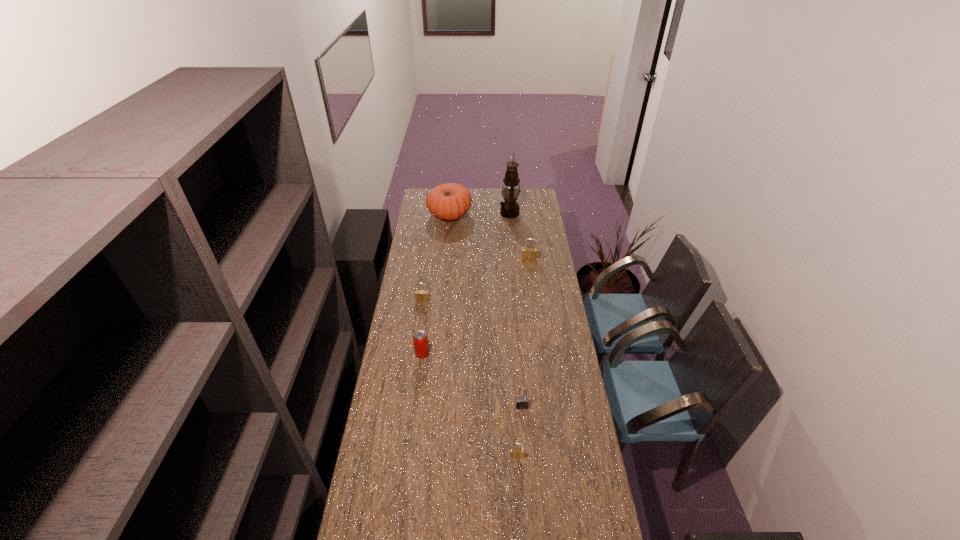
Locate an element on the screen. Image resolution: width=960 pixels, height=540 pixels. oil lamp is located at coordinates (509, 208).

At what (x,y) coordinates should I click in order to perform the action: click on brown oil lamp. Please return your answer as a coordinate pair (x, y). Looking at the image, I should click on (509, 208).

Image resolution: width=960 pixels, height=540 pixels. I want to click on pumpkin, so click(450, 201).

Locate an element on the screen. orange pumpkin is located at coordinates (450, 201).

Image resolution: width=960 pixels, height=540 pixels. Find the location of `the tallest padlock`. the tallest padlock is located at coordinates (528, 254).

Locate an element on the screen. The height and width of the screenshot is (540, 960). the sixth nearest object is located at coordinates (528, 254).

Image resolution: width=960 pixels, height=540 pixels. Identify the location of the fifth farthest object. (421, 347).

Locate an element on the screen. beer can is located at coordinates (421, 347).

Locate an element on the screen. the right gray padlock is located at coordinates (521, 402).

Where is `the farther gray padlock`? the farther gray padlock is located at coordinates (521, 402).